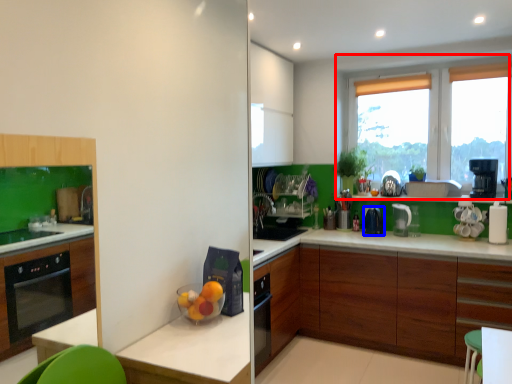
Question: Which object appears farthest to the camera in this image, window (highlighted by a red box) or kitchen appliance (highlighted by a blue box)?

Choices:
 (A) window
 (B) kitchen appliance

Answer: (B)